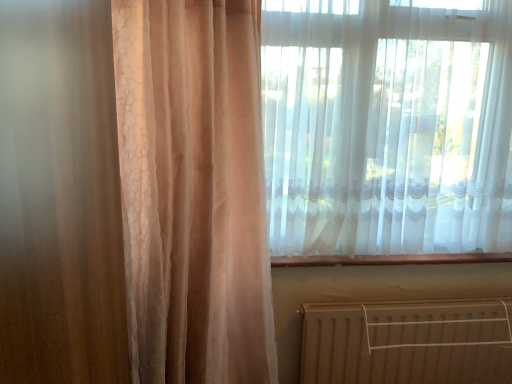
In order to click on white sheer curtain at upper right in this screenshot , I will do `click(387, 126)`.

This screenshot has width=512, height=384. What do you see at coordinates (387, 126) in the screenshot?
I see `white sheer curtain at upper right` at bounding box center [387, 126].

This screenshot has height=384, width=512. Find the location of `brown metallic radiator at lower right`. brown metallic radiator at lower right is located at coordinates (407, 342).

What is the approximate height of brown metallic radiator at lower right?

It is 17.67 inches.

What do you see at coordinates (407, 342) in the screenshot? I see `brown metallic radiator at lower right` at bounding box center [407, 342].

Where is `white sheer curtain at upper right`? The height and width of the screenshot is (384, 512). white sheer curtain at upper right is located at coordinates (387, 126).

Considering the positions of objects white sheer curtain at upper right and brown metallic radiator at lower right in the image provided, who is more to the left, white sheer curtain at upper right or brown metallic radiator at lower right?

white sheer curtain at upper right is more to the left.

Which object is further away from the camera taking this photo, white sheer curtain at upper right or brown metallic radiator at lower right?

brown metallic radiator at lower right is further away from the camera.

Is point (321, 119) positioned after point (438, 313)?

No, it is not.

From the image's perspective, is white sheer curtain at upper right under brown metallic radiator at lower right?

Actually, white sheer curtain at upper right appears above brown metallic radiator at lower right in the image.

From a real-world perspective, is white sheer curtain at upper right physically located above or below brown metallic radiator at lower right?

white sheer curtain at upper right is above brown metallic radiator at lower right.

Which of these two, white sheer curtain at upper right or brown metallic radiator at lower right, is thinner?

Thinner between the two is brown metallic radiator at lower right.

Can you confirm if white sheer curtain at upper right is shorter than brown metallic radiator at lower right?

Incorrect, the height of white sheer curtain at upper right does not fall short of that of brown metallic radiator at lower right.

Which of these two, white sheer curtain at upper right or brown metallic radiator at lower right, is smaller?

Smaller between the two is brown metallic radiator at lower right.

Is white sheer curtain at upper right inside the boundaries of brown metallic radiator at lower right, or outside?

white sheer curtain at upper right cannot be found inside brown metallic radiator at lower right.

From the picture: Are white sheer curtain at upper right and brown metallic radiator at lower right beside each other?

No, white sheer curtain at upper right is not making contact with brown metallic radiator at lower right.

Is white sheer curtain at upper right aimed at brown metallic radiator at lower right?

No.

You are a GUI agent. You are given a task and a screenshot of the screen. Output one action in this format:
    pyautogui.click(x=<x>, y=<y>)
    Task: Click on the curtain in front of the brown metallic radiator at lower right
    
    Given the screenshot: What is the action you would take?
    pyautogui.click(x=387, y=126)

Can you confirm if brown metallic radiator at lower right is positioned to the left of white sheer curtain at upper right?

Incorrect, brown metallic radiator at lower right is not on the left side of white sheer curtain at upper right.

Which is behind, brown metallic radiator at lower right or white sheer curtain at upper right?

brown metallic radiator at lower right.

Which is in front, point (495, 377) or point (365, 162)?

Point (365, 162)

From the image's perspective, is brown metallic radiator at lower right over white sheer curtain at upper right?

No, from the image's perspective, brown metallic radiator at lower right is not over white sheer curtain at upper right.

From a real-world perspective, between brown metallic radiator at lower right and white sheer curtain at upper right, who is vertically lower?

brown metallic radiator at lower right is physically lower.

Can you confirm if brown metallic radiator at lower right is thinner than white sheer curtain at upper right?

Correct, the width of brown metallic radiator at lower right is less than that of white sheer curtain at upper right.

Who is taller, brown metallic radiator at lower right or white sheer curtain at upper right?

With more height is white sheer curtain at upper right.

Based on their sizes in the image, would you say brown metallic radiator at lower right is bigger or smaller than white sheer curtain at upper right?

Clearly, brown metallic radiator at lower right is smaller in size than white sheer curtain at upper right.

Choose the correct answer: Is brown metallic radiator at lower right inside white sheer curtain at upper right or outside it?

brown metallic radiator at lower right is outside white sheer curtain at upper right.

Are brown metallic radiator at lower right and white sheer curtain at upper right making contact?

There is a gap between brown metallic radiator at lower right and white sheer curtain at upper right.

Does brown metallic radiator at lower right turn towards white sheer curtain at upper right?

No, brown metallic radiator at lower right is not aimed at white sheer curtain at upper right.

How many degrees apart are the facing directions of brown metallic radiator at lower right and white sheer curtain at upper right?

They differ by 0.761 degrees in their facing directions.

Locate an element on the screen. The image size is (512, 384). curtain that appears above the brown metallic radiator at lower right (from the image's perspective) is located at coordinates (387, 126).

At what (x,y) coordinates should I click in order to perform the action: click on curtain that appears in front of the brown metallic radiator at lower right. Please return your answer as a coordinate pair (x, y). Looking at the image, I should click on (387, 126).

The image size is (512, 384). I want to click on curtain on the left side of brown metallic radiator at lower right, so click(x=387, y=126).